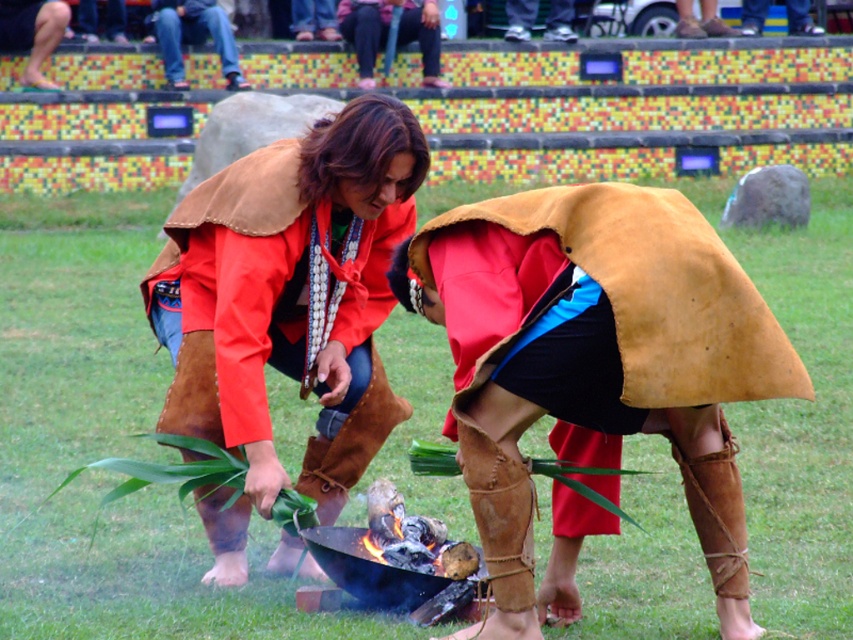
Describe the element at coordinates (595, 368) in the screenshot. I see `brown leather trench coat at center` at that location.

Between brown leather trench coat at center and brown leather pants at center, which one is positioned lower?

brown leather trench coat at center

You are a GUI agent. You are given a task and a screenshot of the screen. Output one action in this format:
    pyautogui.click(x=<x>, y=<y>)
    Task: Click on the brown leather trench coat at center
    This screenshot has height=640, width=853.
    Given the screenshot: What is the action you would take?
    pyautogui.click(x=595, y=368)

Between point (682, 330) and point (292, 273), which one is positioned behind?

Point (292, 273)

Between brown leather trench coat at center and matte red jacket at center, which one appears on the right side from the viewer's perspective?

From the viewer's perspective, brown leather trench coat at center appears more on the right side.

Who is more distant from viewer, (486, 442) or (326, 339)?

Point (326, 339)

Identify the location of brown leather trench coat at center. Image resolution: width=853 pixels, height=640 pixels. (595, 368).

Between matte red jacket at center and brown leather pants at center, which one appears on the right side from the viewer's perspective?

Positioned to the right is matte red jacket at center.

Does point (381, 419) come closer to viewer compared to point (172, 13)?

Yes, point (381, 419) is closer to viewer.

Find the location of `matte red jacket at center`. matte red jacket at center is located at coordinates (287, 305).